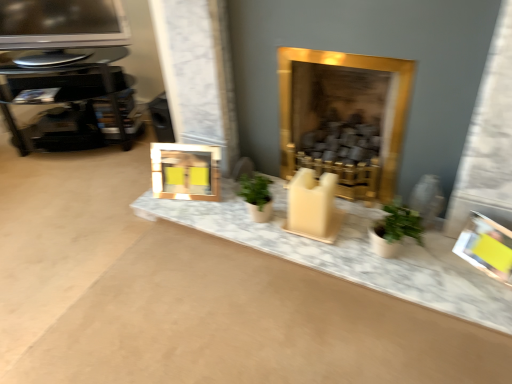
The image size is (512, 384). In order to click on free point in front of gold metallic picture frame at center, which is counted as the 1th picture frame, starting from the left in this screenshot , I will do `click(199, 208)`.